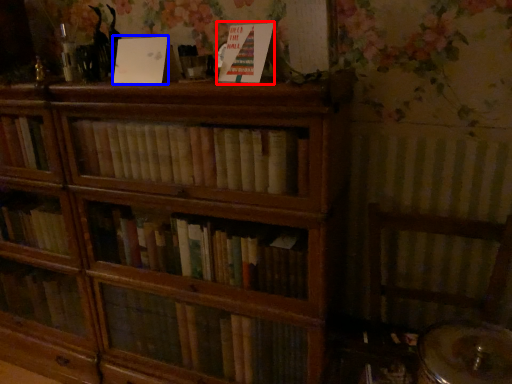
Question: Which object appears closest to the camera in this image, paperback book (highlighted by a red box) or paperback book (highlighted by a blue box)?

Choices:
 (A) paperback book
 (B) paperback book

Answer: (A)